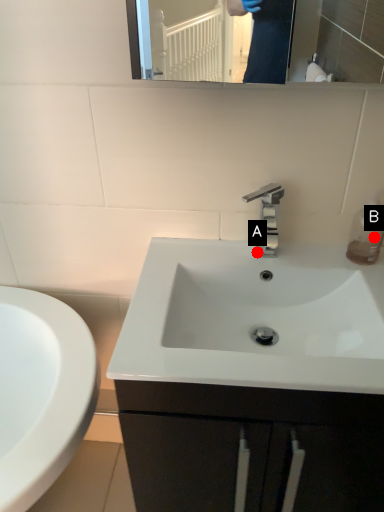
Question: Two points are circled on the image, labeled by A and B beside each circle. Which point is closer to the camera?

Choices:
 (A) A is closer
 (B) B is closer

Answer: (B)